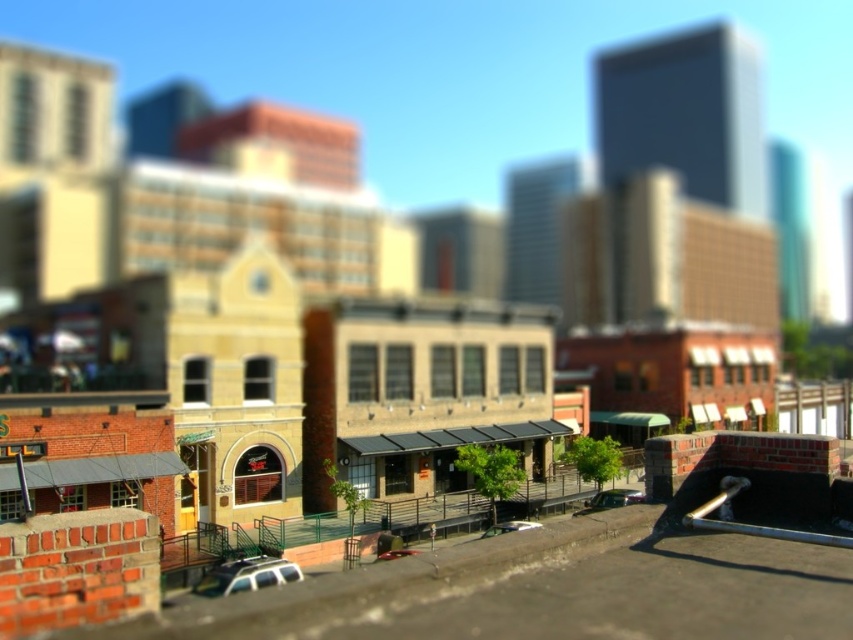
Between point (274, 573) and point (624, 504), which one is positioned behind?

Positioned behind is point (624, 504).

Who is shorter, white matte car at lower center or satin black car at lower center?

white matte car at lower center

Locate an element on the screen. white matte car at lower center is located at coordinates [247, 576].

Based on the photo, is satin black car at lower center below metallic silver car at center?

Yes, satin black car at lower center is below metallic silver car at center.

Can you confirm if satin black car at lower center is taller than metallic silver car at center?

No.

Is point (630, 493) in front of point (491, 529)?

No, (630, 493) is further to viewer.

Locate an element on the screen. This screenshot has height=640, width=853. satin black car at lower center is located at coordinates (612, 499).

Does white matte car at lower center lie in front of metallic silver car at center?

Yes, it is.

How far apart are white matte car at lower center and metallic silver car at center?

A distance of 36.40 feet exists between white matte car at lower center and metallic silver car at center.

The width and height of the screenshot is (853, 640). Identify the location of white matte car at lower center. (247, 576).